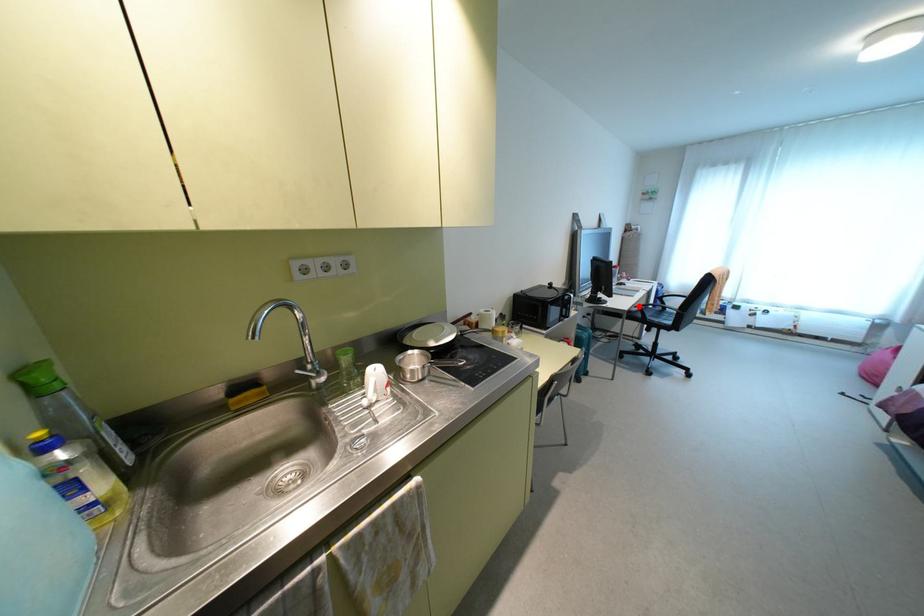
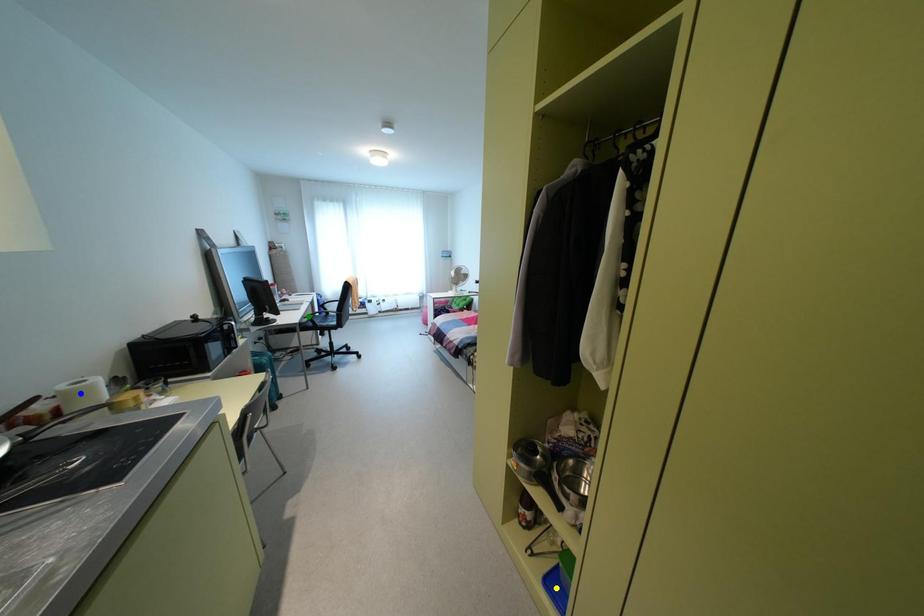
Question: I am providing you with two images of the same scene from different viewpoints. A red point is marked on the first image. You are given multiple points on the second image. Can you choose the point in image 2 that corresponds to the point in image 1?

Choices:
 (A) yellow point
 (B) blue point
 (C) green point

Answer: (C)